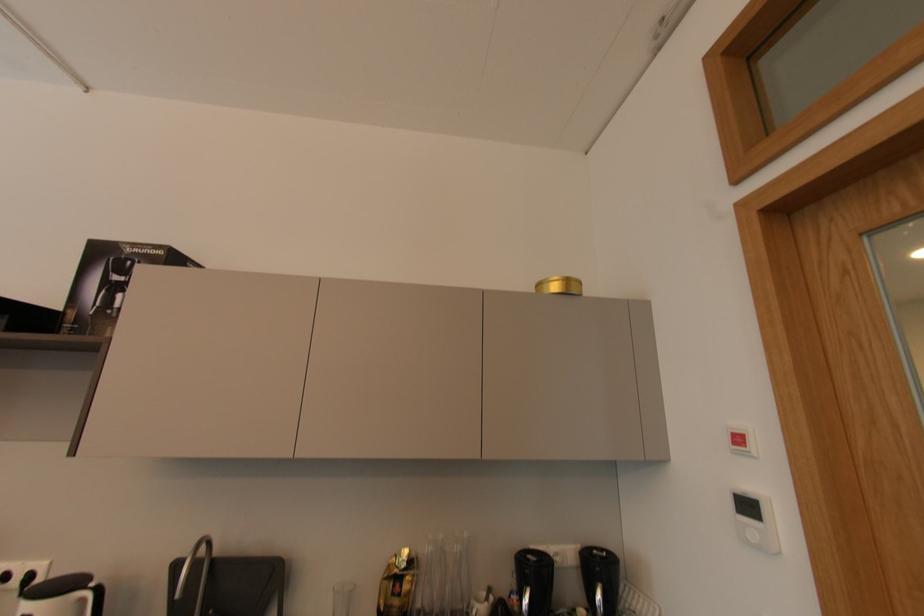
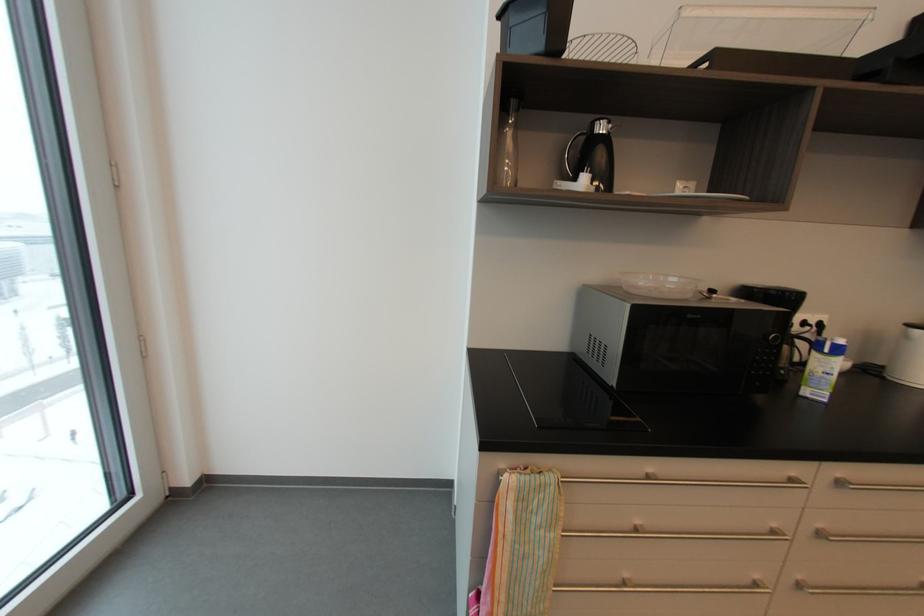
Question: The images are taken continuously from a first-person perspective. In which direction are you moving?

Choices:
 (A) Left
 (B) Right
 (C) Forward
 (D) Backward

Answer: (A)